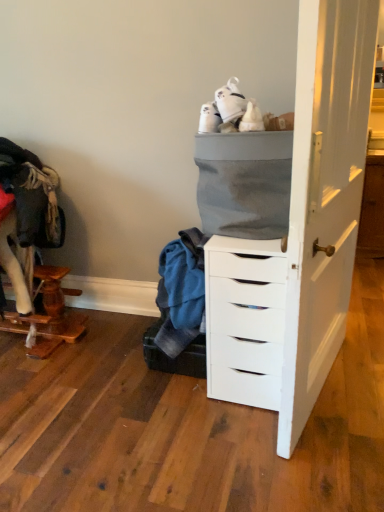
Image resolution: width=384 pixels, height=512 pixels. Describe the element at coordinates (244, 183) in the screenshot. I see `gray fabric basket at upper center` at that location.

Where is `white matte chest of drawers at center`? This screenshot has height=512, width=384. white matte chest of drawers at center is located at coordinates (244, 320).

Describe the element at coordinates (244, 320) in the screenshot. I see `white matte chest of drawers at center` at that location.

What do you see at coordinates (55, 312) in the screenshot? Image resolution: width=384 pixels, height=512 pixels. I see `wooden cat tree at left` at bounding box center [55, 312].

Where is `gray fabric basket at upper center`? gray fabric basket at upper center is located at coordinates (244, 183).

Which is more to the left, white matte chest of drawers at center or gray fabric basket at upper center?

Positioned to the left is gray fabric basket at upper center.

Find the location of a particular element. This screenshot has height=512, width=384. cabinetry in front of the white matte chest of drawers at center is located at coordinates click(244, 183).

Is white matte chest of drawers at center touching gray fabric basket at upper center?

No, white matte chest of drawers at center is not making contact with gray fabric basket at upper center.

Is white matte chest of drawers at center positioned with its back to gray fabric basket at upper center?

No.

Can you confirm if gray fabric basket at upper center is positioned to the right of white matte chest of drawers at center?

Incorrect, gray fabric basket at upper center is not on the right side of white matte chest of drawers at center.

Considering the positions of objects gray fabric basket at upper center and white matte chest of drawers at center in the image provided, who is in front, gray fabric basket at upper center or white matte chest of drawers at center?

gray fabric basket at upper center is closer to the camera.

From the image's perspective, between gray fabric basket at upper center and white matte chest of drawers at center, who is located below?

white matte chest of drawers at center is shown below in the image.

How different are the orientations of wooden cat tree at left and gray fabric basket at upper center in degrees?

32.5 degrees separate the facing orientations of wooden cat tree at left and gray fabric basket at upper center.

Considering the sizes of objects wooden cat tree at left and gray fabric basket at upper center in the image provided, who is smaller, wooden cat tree at left or gray fabric basket at upper center?

Smaller between the two is gray fabric basket at upper center.

From a real-world perspective, is wooden cat tree at left above or below gray fabric basket at upper center?

Clearly, from a real-world perspective, wooden cat tree at left is below gray fabric basket at upper center.

From the picture: From a real-world perspective, does gray fabric basket at upper center stand above wooden cat tree at left?

Correct, in the physical world, gray fabric basket at upper center is higher than wooden cat tree at left.

Can you confirm if gray fabric basket at upper center is shorter than wooden cat tree at left?

No, gray fabric basket at upper center is not shorter than wooden cat tree at left.

Measure the distance from gray fabric basket at upper center to wooden cat tree at left.

gray fabric basket at upper center and wooden cat tree at left are 3.69 feet apart.

From the image's perspective, which is below, gray fabric basket at upper center or wooden cat tree at left?

wooden cat tree at left is shown below in the image.

Between white matte chest of drawers at center and wooden cat tree at left, which one has larger width?

white matte chest of drawers at center is wider.

Looking at this image, is white matte chest of drawers at center positioned with its back to wooden cat tree at left?

No.

Is white matte chest of drawers at center completely or partially outside of wooden cat tree at left?

white matte chest of drawers at center is positioned outside wooden cat tree at left.

How many degrees apart are the facing directions of white matte chest of drawers at center and wooden cat tree at left?

2.53 degrees.

Which of these two, wooden cat tree at left or white matte chest of drawers at center, is bigger?

wooden cat tree at left is bigger.

From a real-world perspective, which object stands above the other?

white matte chest of drawers at center.

Is wooden cat tree at left far away from white matte chest of drawers at center?

wooden cat tree at left is positioned a significant distance from white matte chest of drawers at center.

You are a GUI agent. You are given a task and a screenshot of the screen. Output one action in this format:
    pyautogui.click(x=<x>, y=<y>)
    Task: Click on the chest of drawers lying on the right of wooden cat tree at left
    The image size is (384, 512).
    Given the screenshot: What is the action you would take?
    pyautogui.click(x=244, y=320)

This screenshot has width=384, height=512. In order to click on chest of drawers on the right of gray fabric basket at upper center in this screenshot , I will do click(244, 320).

Where is `cabinetry positioned vertically above the white matte chest of drawers at center (from a real-world perspective)`? Image resolution: width=384 pixels, height=512 pixels. cabinetry positioned vertically above the white matte chest of drawers at center (from a real-world perspective) is located at coordinates (244, 183).

Considering their positions, is wooden cat tree at left positioned closer to white matte chest of drawers at center than gray fabric basket at upper center?

gray fabric basket at upper center lies closer to white matte chest of drawers at center than the other object.

Which object lies nearer to the anchor point wooden cat tree at left, gray fabric basket at upper center or white matte chest of drawers at center?

The object closer to wooden cat tree at left is white matte chest of drawers at center.

When comparing their distances from gray fabric basket at upper center, does wooden cat tree at left or white matte chest of drawers at center seem further?

wooden cat tree at left lies further to gray fabric basket at upper center than the other object.

Considering their positions, is white matte chest of drawers at center positioned further to wooden cat tree at left than gray fabric basket at upper center?

Based on the image, gray fabric basket at upper center appears to be further to wooden cat tree at left.

Considering their positions, is gray fabric basket at upper center positioned closer to white matte chest of drawers at center than wooden cat tree at left?

gray fabric basket at upper center is closer to white matte chest of drawers at center.

Looking at this image, from the image, which object appears to be nearer to gray fabric basket at upper center, white matte chest of drawers at center or wooden cat tree at left?

white matte chest of drawers at center lies closer to gray fabric basket at upper center than the other object.

I want to click on cabinetry situated between wooden cat tree at left and white matte chest of drawers at center from left to right, so click(x=244, y=183).